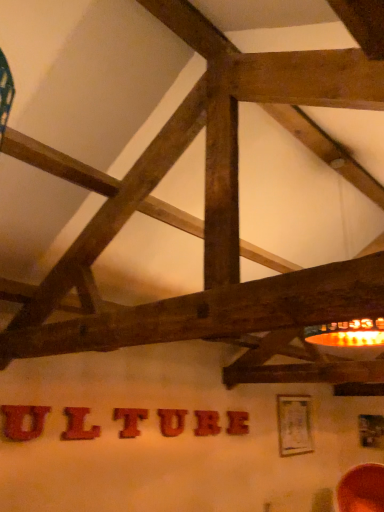
Question: Considering the relative positions of matte red letter at center, marked as the fifth letter in a right-to-left arrangement, and wooden letter t at center, marked as the 4th letter in a back-to-front arrangement, in the image provided, is matte red letter at center, marked as the fifth letter in a right-to-left arrangement, to the left or to the right of wooden letter t at center, marked as the 4th letter in a back-to-front arrangement,?

Choices:
 (A) left
 (B) right

Answer: (A)

Question: Considering the positions of point (77, 412) and point (122, 430), is point (77, 412) closer or farther from the camera than point (122, 430)?

Choices:
 (A) farther
 (B) closer

Answer: (B)

Question: Considering the real-world distances, which object is closest to the white paper at center?

Choices:
 (A) matte red letter at center, the 5th letter in the back-to-front sequence
 (B) wooden letter at center, the second letter in the right-to-left sequence
 (C) brushed wood letter at center, which is counted as the 6th letter, starting from the right
 (D) wooden letter at center, positioned as the fourth letter in front-to-back order
 (E) wooden letter at center, which is the sixth letter in left-to-right order

Answer: (E)

Question: Which object is the closest to the wooden letter at center, the 1th letter in the back-to-front sequence?

Choices:
 (A) brushed wood letter at center, marked as the 1th letter in a front-to-back arrangement
 (B) wooden letter at center, the second letter in the right-to-left sequence
 (C) wooden letter t at center, which is the third letter from front to back
 (D) white paper at center
 (E) wooden letter at center, the 3th letter in the right-to-left sequence

Answer: (B)